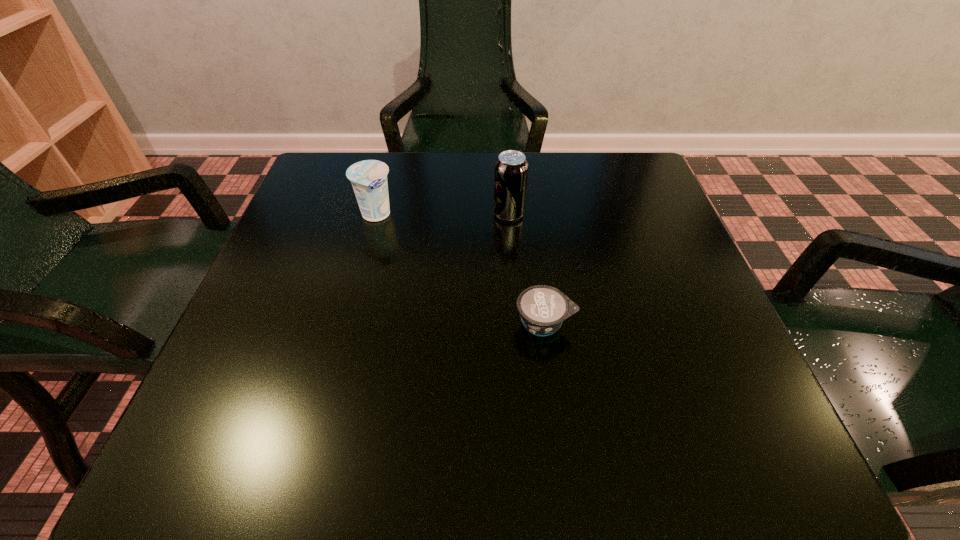
This screenshot has width=960, height=540. Identify the location of object that is at the left edge. (368, 178).

Identify the location of object positioned at the far left corner. This screenshot has height=540, width=960. (368, 178).

The width and height of the screenshot is (960, 540). I want to click on vacant region at the far edge of the desktop, so click(x=453, y=207).

The width and height of the screenshot is (960, 540). Find the location of `vacant area at the near edge of the desktop`. vacant area at the near edge of the desktop is located at coordinates (559, 430).

In the image, there is a desktop. Identify the location of blank space at the left edge. This screenshot has width=960, height=540. (321, 217).

Locate an element on the screen. This screenshot has height=540, width=960. vacant area at the right edge is located at coordinates (654, 251).

The width and height of the screenshot is (960, 540). I want to click on blank space at the far right corner, so [x=618, y=193].

Find the location of a particular element. This screenshot has width=960, height=540. vacant space at the near right corner of the desktop is located at coordinates 746,474.

In order to click on free point between the farther yogurt and the shortest object in this screenshot , I will do `click(460, 269)`.

This screenshot has height=540, width=960. What are the coordinates of `free space between the nearer yogurt and the soda can` in the screenshot? It's located at (527, 268).